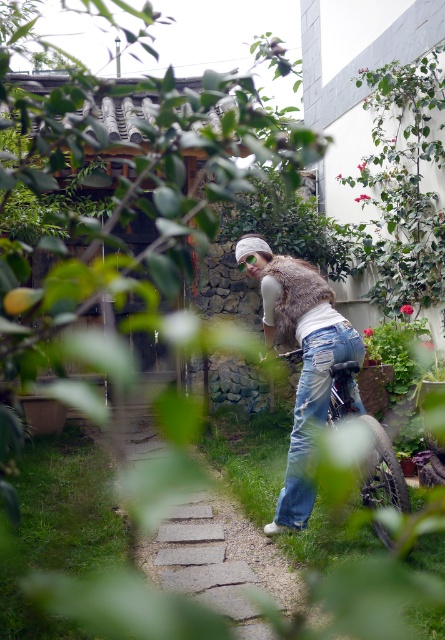
Question: Among these points, which one is nearest to the camera?

Choices:
 (A) [x=318, y=422]
 (B) [x=246, y=561]

Answer: (B)

Question: Does stone paved path at center lie behind denim jeans at center?

Choices:
 (A) yes
 (B) no

Answer: (B)

Question: Which of these objects is positioned closest to the fur vest at center?

Choices:
 (A) denim jeans at center
 (B) stone paved path at center

Answer: (A)

Question: Which point is closer to the camera?

Choices:
 (A) fur vest at center
 (B) denim jeans at center
 (C) stone paved path at center

Answer: (C)

Question: Does stone paved path at center appear under fur vest at center?

Choices:
 (A) no
 (B) yes

Answer: (B)

Question: Can you confirm if stone paved path at center is bigger than fur vest at center?

Choices:
 (A) no
 (B) yes

Answer: (A)